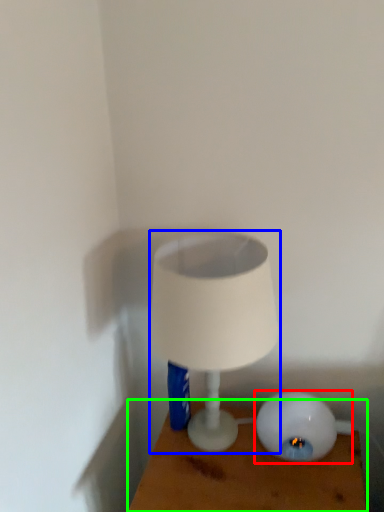
Question: Estimate the real-world distances between objects in this image. Which object is closer to lamp (highlighted by a red box), lamp (highlighted by a blue box) or furniture (highlighted by a green box)?

Choices:
 (A) lamp
 (B) furniture

Answer: (B)